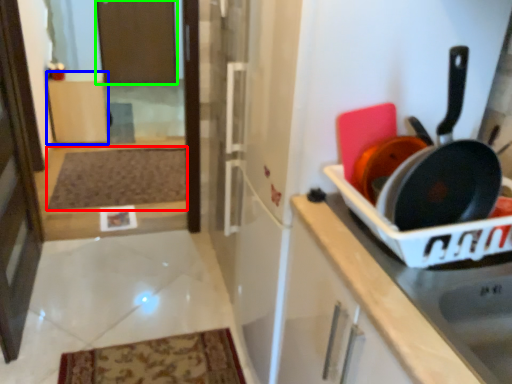
Question: Which object is the farthest from mat (highlighted by a red box)? Choose among these: cabinetry (highlighted by a blue box) or screen door (highlighted by a green box).

Choices:
 (A) cabinetry
 (B) screen door

Answer: (B)